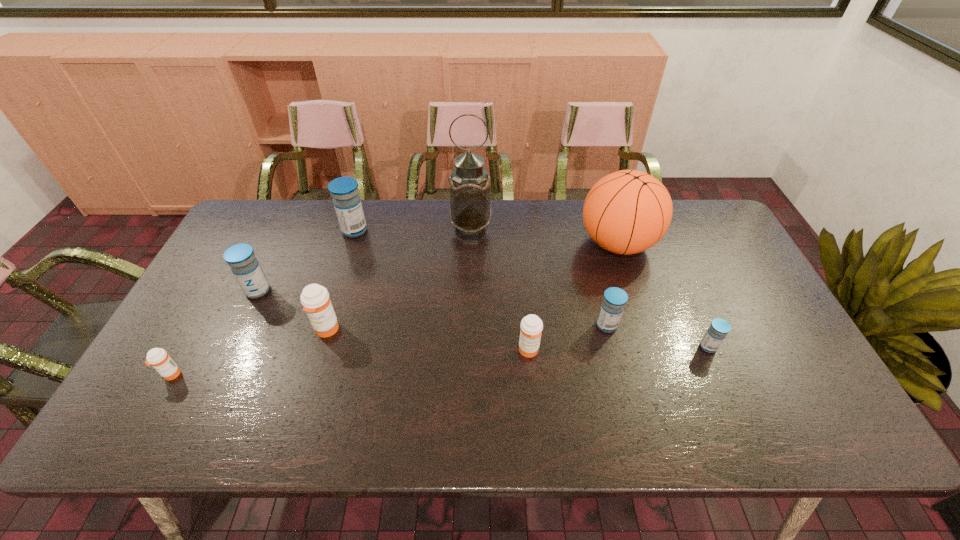
Image resolution: width=960 pixels, height=540 pixels. Identify the location of the fifth object from right to left. (470, 212).

Find the location of a particular element. Image resolution: width=960 pixels, height=540 pixels. the tallest object is located at coordinates (470, 212).

Where is `the eighth shortest object`? Image resolution: width=960 pixels, height=540 pixels. the eighth shortest object is located at coordinates (626, 212).

You are a GUI agent. You are given a task and a screenshot of the screen. Output one action in this format:
    pyautogui.click(x=<x>, y=<y>)
    Task: Click on the farthest blue medicine
    The height and width of the screenshot is (540, 960).
    Given the screenshot: What is the action you would take?
    click(347, 202)

Identify the location of the biggest blue medicine. The height and width of the screenshot is (540, 960). (347, 202).

What are the coordinates of `the leftmost blue medicine` in the screenshot? It's located at (245, 267).

You are a GUI agent. You are given a task and a screenshot of the screen. Output one action in this format:
    pyautogui.click(x=<x>, y=<y>)
    Task: Click on the third smallest blue medicine
    
    Given the screenshot: What is the action you would take?
    pyautogui.click(x=245, y=267)

You are a GUI agent. You are given a task and a screenshot of the screen. Output one action in this format:
    pyautogui.click(x=<x>, y=<y>)
    Task: Click on the second orange medicine from right to left
    The height and width of the screenshot is (540, 960).
    Given the screenshot: What is the action you would take?
    pyautogui.click(x=315, y=299)

This screenshot has width=960, height=540. What are the coordinates of `the second smallest blue medicine` in the screenshot? It's located at pyautogui.click(x=614, y=300).

Locate an element on the screen. The width and height of the screenshot is (960, 540). the sixth medicine from left to right is located at coordinates (614, 300).